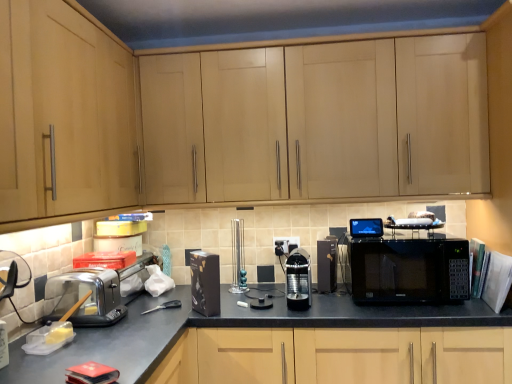
Image resolution: width=512 pixels, height=384 pixels. What are the coordinates of `vacant region to the right of sleek black coffee machine at center, the 2th appliance positioned from the right` in the screenshot? It's located at (337, 303).